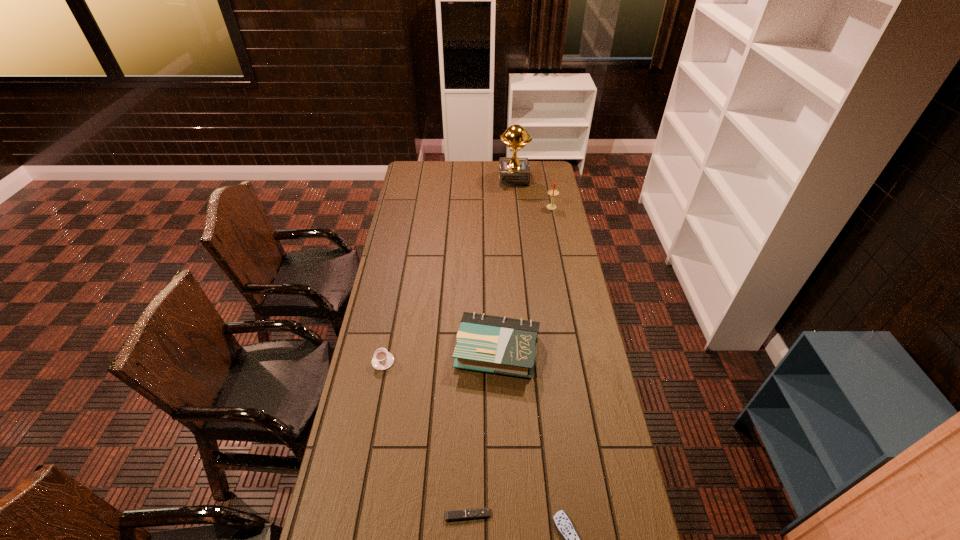
I want to click on object that ranks as the fifth closest to the rightmost object, so click(451, 515).

At what (x,y) coordinates should I click in order to perform the action: click on free space that satisfies the following two spatial constraints: 1. on the front-facing side of the rightmost object; 2. on the right side of the award. Please return your answer as a coordinate pair (x, y). This screenshot has width=960, height=540. Looking at the image, I should click on (516, 208).

Locate an element on the screen. free point that satisfies the following two spatial constraints: 1. on the front-facing side of the rightmost object; 2. on the left side of the award is located at coordinates (516, 208).

Where is `vacant region that satisfies the following two spatial constraints: 1. on the handle side of the shortest object; 2. on the right side of the fourth tallest object`? The width and height of the screenshot is (960, 540). vacant region that satisfies the following two spatial constraints: 1. on the handle side of the shortest object; 2. on the right side of the fourth tallest object is located at coordinates (354, 515).

Where is `free space that satisfies the following two spatial constraints: 1. on the front-facing side of the farthest object; 2. on the front side of the paperback book`? This screenshot has width=960, height=540. free space that satisfies the following two spatial constraints: 1. on the front-facing side of the farthest object; 2. on the front side of the paperback book is located at coordinates (532, 351).

Identify the location of vacant space that satisfies the following two spatial constraints: 1. on the handle side of the shorter remote control; 2. on the right side of the leftmost object. The image size is (960, 540). (354, 515).